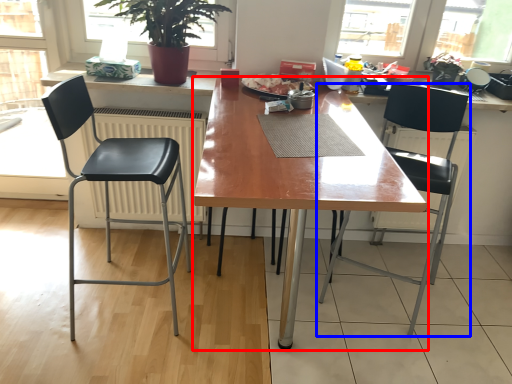
Question: Among these objects, which one is nearest to the camera, desk (highlighted by a red box) or chair (highlighted by a blue box)?

Choices:
 (A) desk
 (B) chair

Answer: (A)